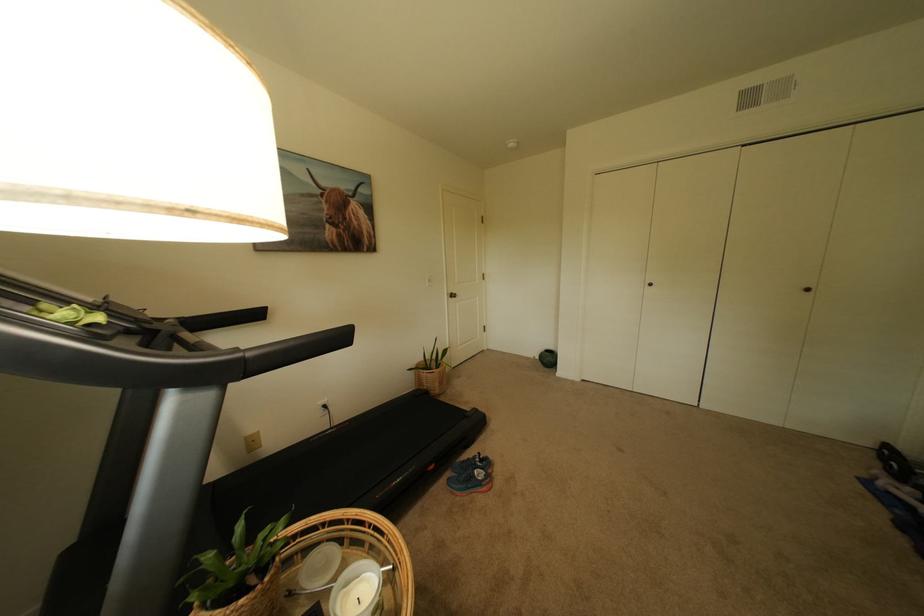
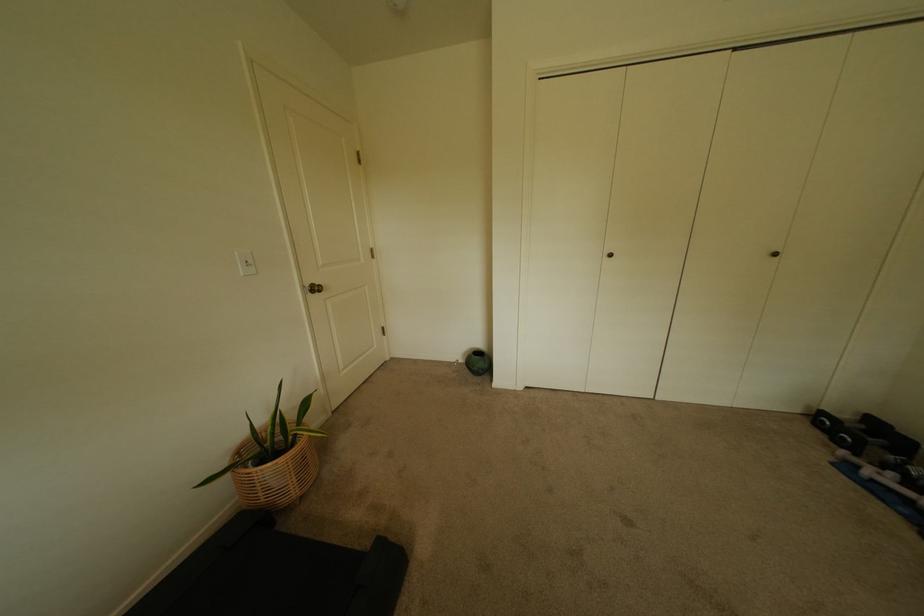
Locate, in the second image, the point that corresponds to point (816, 292) in the first image.

(784, 256)